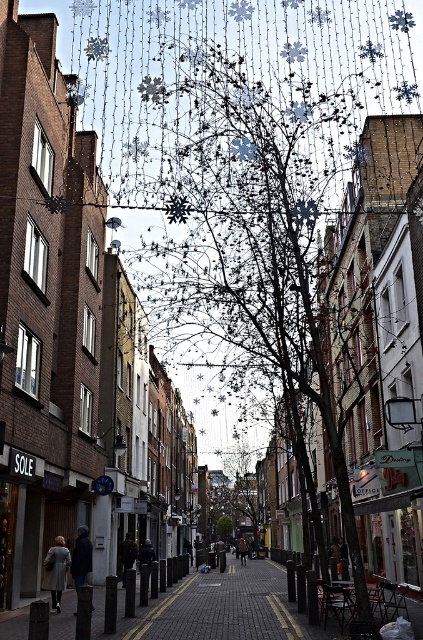
Can you confirm if brick pavement at center is positioned to the right of green leafy tree at center?

Correct, you'll find brick pavement at center to the right of green leafy tree at center.

Does brick pavement at center appear on the left side of green leafy tree at center?

No, brick pavement at center is not to the left of green leafy tree at center.

In order to click on brick pavement at center in this screenshot , I will do `click(216, 609)`.